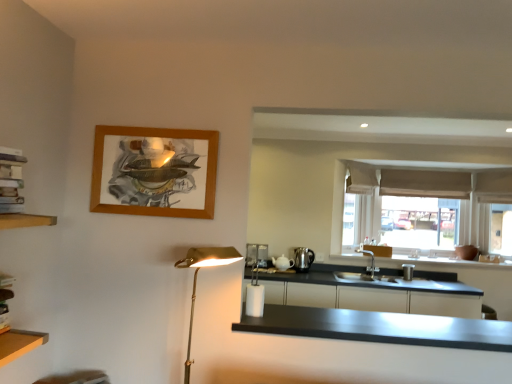
Identify the location of free spot in front of white ceramic teapot at upper right, which is counted as the first appliance, starting from the left. The image size is (512, 384). (285, 278).